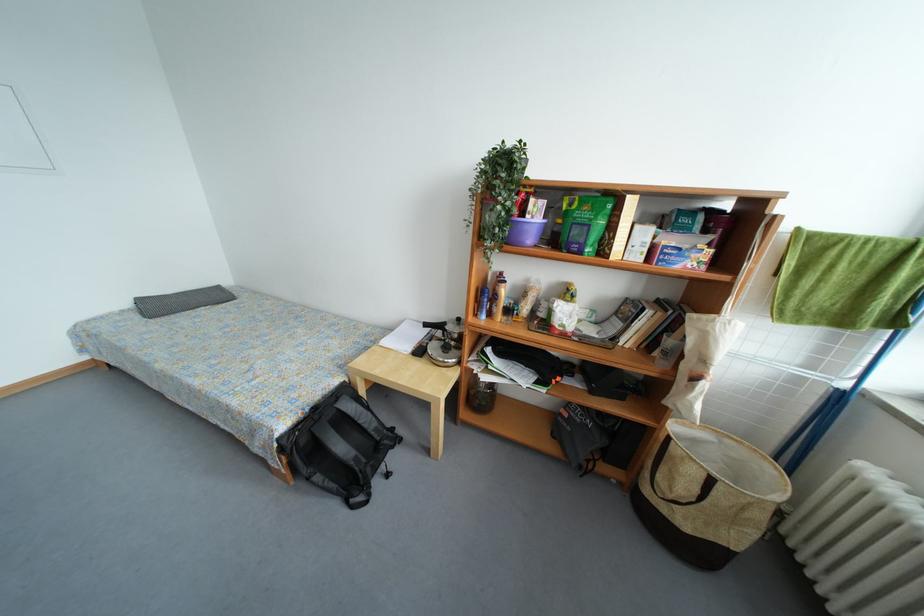
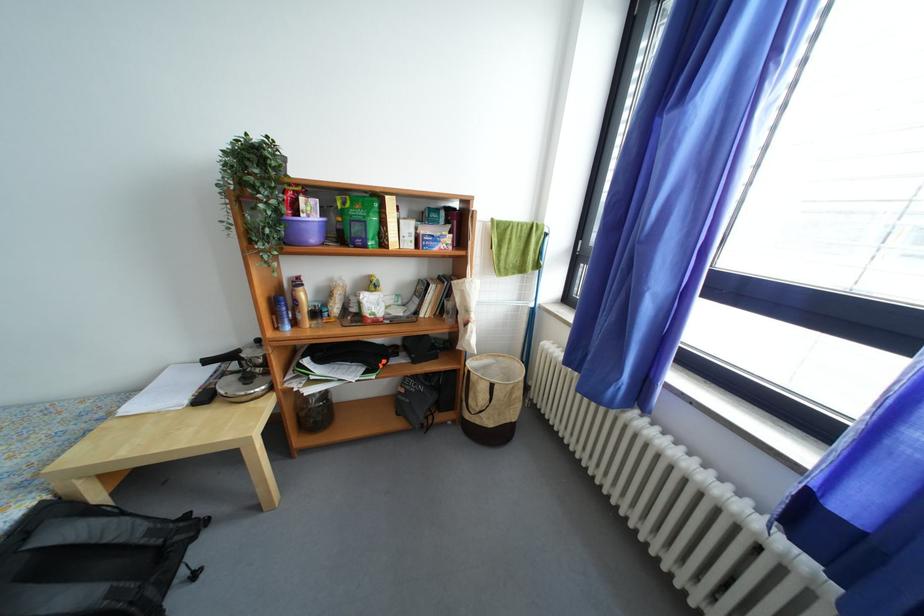
In the second image, find the point that corresponds to (502,315) in the first image.

(306, 322)